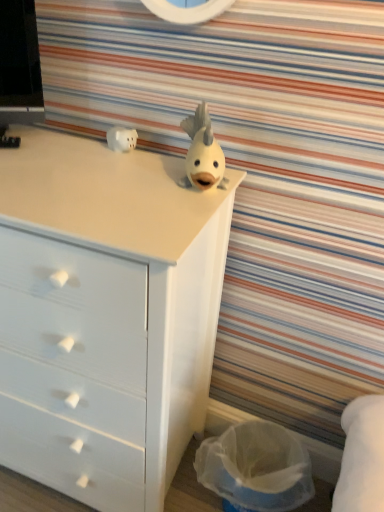
Question: In terms of width, does white matte fish at center, positioned as the second toy in left-to-right order, look wider or thinner when compared to white matte chest of drawers at upper center?

Choices:
 (A) wide
 (B) thin

Answer: (B)

Question: From the image's perspective, relative to white matte chest of drawers at upper center, is white matte fish at center, placed as the 1th toy when sorted from front to back, above or below?

Choices:
 (A) below
 (B) above

Answer: (B)

Question: Based on their relative distances, which object is nearer to the white matte fish at center, placed as the 1th toy when sorted from front to back?

Choices:
 (A) translucent plastic laundry basket at lower right
 (B) white matte piggy bank at upper left, which is counted as the second toy, starting from the right
 (C) white matte chest of drawers at upper center

Answer: (B)

Question: Considering the real-world distances, which object is farthest from the white matte piggy bank at upper left, which is counted as the second toy, starting from the right?

Choices:
 (A) white matte chest of drawers at upper center
 (B) white matte fish at center, placed as the 1th toy when sorted from front to back
 (C) translucent plastic laundry basket at lower right

Answer: (C)